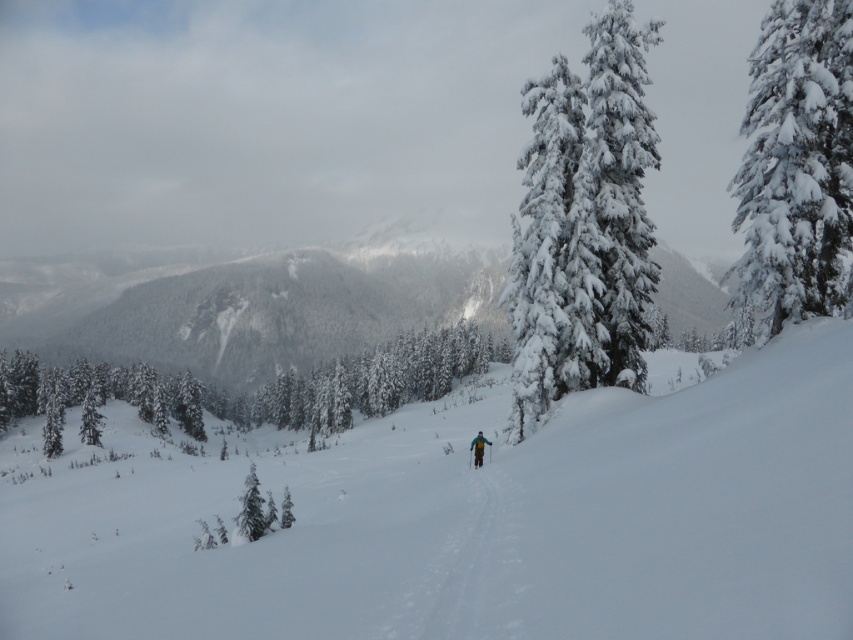
Question: Which of the following is the closest to the observer?

Choices:
 (A) (821, 616)
 (B) (799, 317)

Answer: (A)

Question: Which point is closer to the camera?

Choices:
 (A) teal fabric jacket at center
 (B) white snow ski slope at center

Answer: (B)

Question: Can you confirm if white snow ski slope at center is positioned below teal fabric jacket at center?

Choices:
 (A) no
 (B) yes

Answer: (B)

Question: Is snow-covered evergreen at center thinner than snow-covered evergreen at right?

Choices:
 (A) yes
 (B) no

Answer: (A)

Question: Does snow-covered evergreen at center have a greater width compared to snow-covered evergreen at right?

Choices:
 (A) yes
 (B) no

Answer: (B)

Question: Considering the real-world distances, which object is farthest from the white snow ski slope at center?

Choices:
 (A) teal fabric jacket at center
 (B) snow-covered evergreen at center
 (C) snow-covered evergreen at right

Answer: (C)